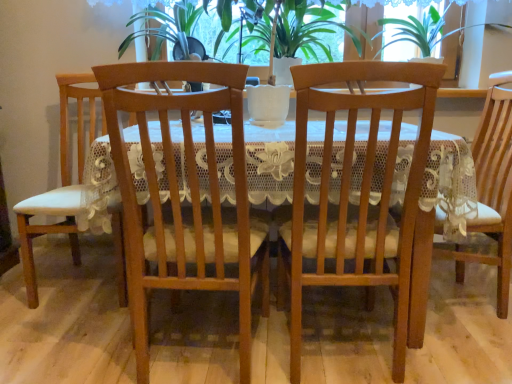
Locate an element on the screen. Image resolution: width=512 pixels, height=384 pixels. vacant space in white leather chair at left, the 4th chair in the right-to-left sequence (from a real-world perspective) is located at coordinates (89, 284).